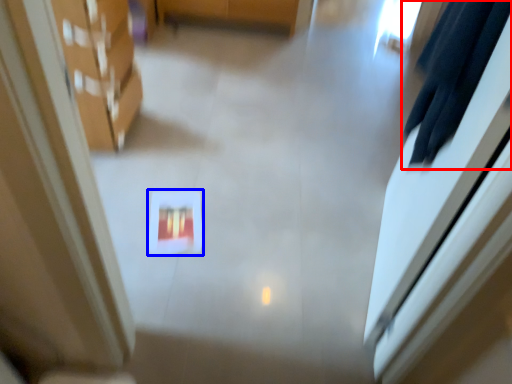
Question: Which object is closer to the camera taking this photo, robe (highlighted by a red box) or square (highlighted by a blue box)?

Choices:
 (A) robe
 (B) square

Answer: (A)